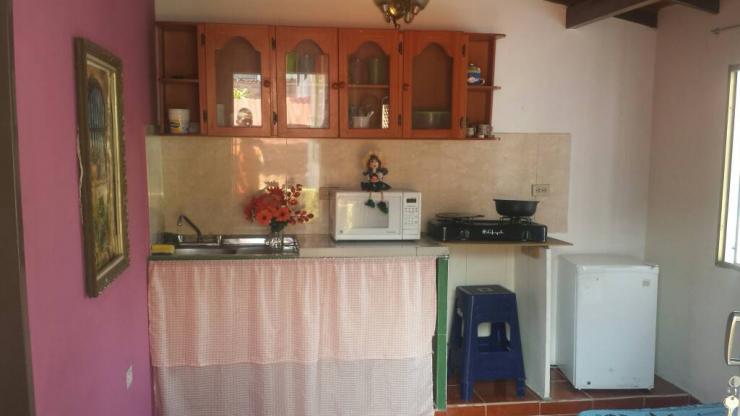
The width and height of the screenshot is (740, 416). Find the location of `microwave`. microwave is located at coordinates (402, 217).